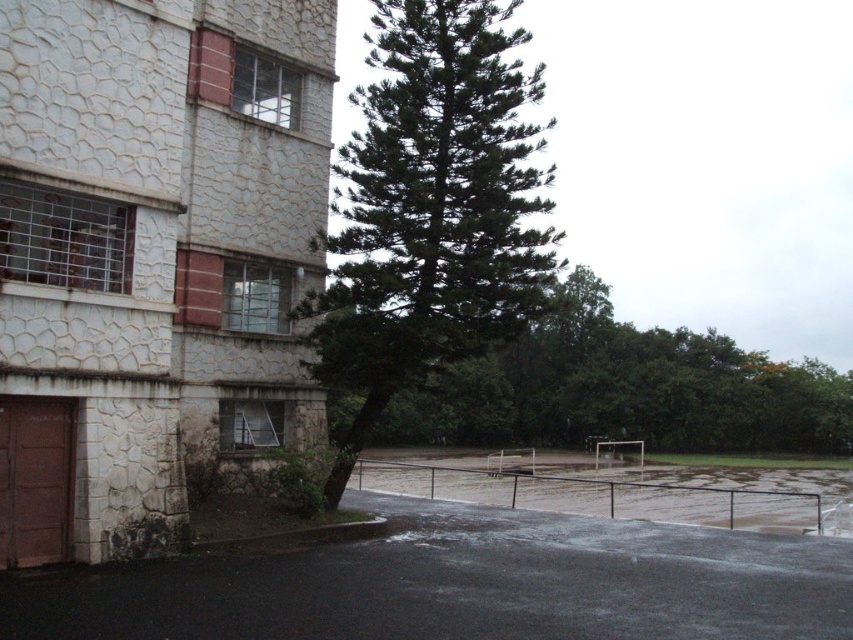
Question: Is dark green leafy tree at center behind green leafy tree at center?

Choices:
 (A) no
 (B) yes

Answer: (B)

Question: Among these objects, which one is farthest from the camera?

Choices:
 (A) green leafy tree at center
 (B) dark green leafy tree at center

Answer: (B)

Question: Can you confirm if dark green leafy tree at center is thinner than green leafy tree at center?

Choices:
 (A) no
 (B) yes

Answer: (B)

Question: Which of the following is the closest to the observer?

Choices:
 (A) (502, 305)
 (B) (531, 422)

Answer: (A)

Question: Does dark green leafy tree at center have a smaller size compared to green leafy tree at center?

Choices:
 (A) no
 (B) yes

Answer: (A)